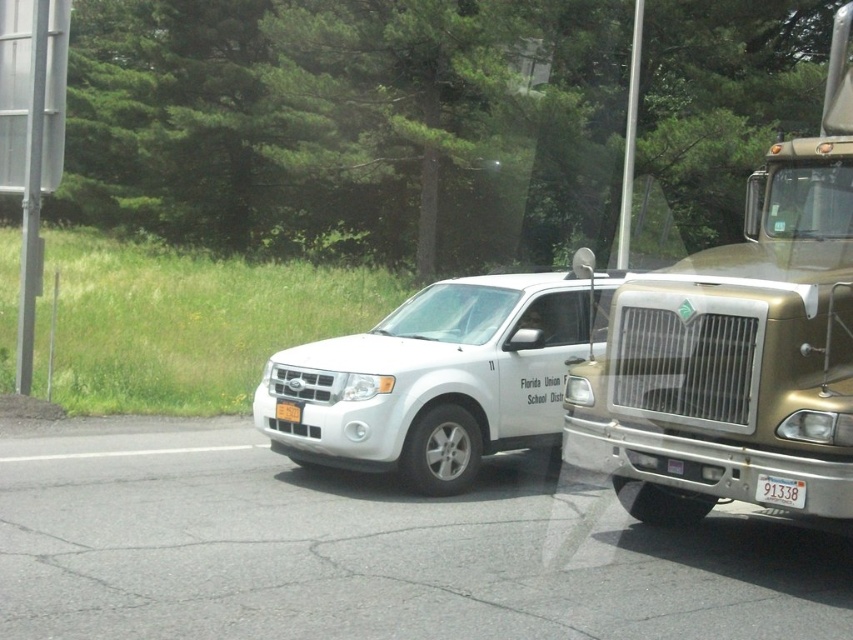
Is white matte suv at center taller than white plastic license plate at center?

Yes, white matte suv at center is taller than white plastic license plate at center.

Which is behind, point (567, 291) or point (756, 486)?

The point (567, 291) is behind.

I want to click on white matte suv at center, so click(438, 378).

Does gold metallic truck at right have a lesser height compared to white plastic license plate at center?

In fact, gold metallic truck at right may be taller than white plastic license plate at center.

The height and width of the screenshot is (640, 853). What do you see at coordinates (737, 346) in the screenshot?
I see `gold metallic truck at right` at bounding box center [737, 346].

The width and height of the screenshot is (853, 640). I want to click on gold metallic truck at right, so click(737, 346).

Where is `gold metallic truck at right`? gold metallic truck at right is located at coordinates 737,346.

Can you confirm if white plastic license plate at center is smaller than yellow matte license plate at center?

Indeed, white plastic license plate at center has a smaller size compared to yellow matte license plate at center.

From the picture: Which is more to the right, white plastic license plate at center or yellow matte license plate at center?

From the viewer's perspective, white plastic license plate at center appears more on the right side.

Who is more distant from viewer, (775, 484) or (289, 406)?

Point (289, 406)

In order to click on white plastic license plate at center in this screenshot , I will do `click(780, 492)`.